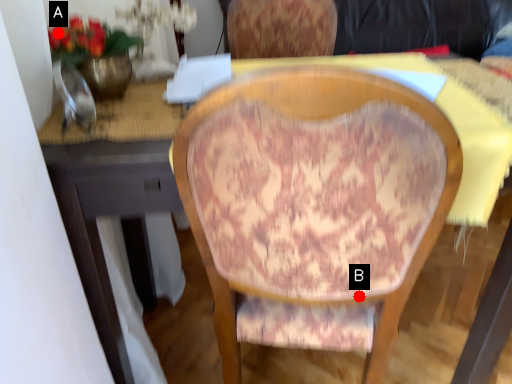
Question: Two points are circled on the image, labeled by A and B beside each circle. Which point appears closest to the camera in this image?

Choices:
 (A) A is closer
 (B) B is closer

Answer: (B)